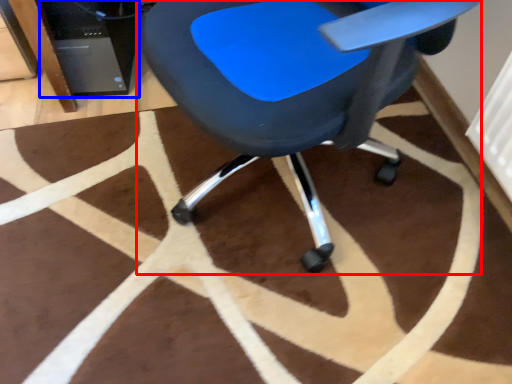
Question: Which object appears farthest to the camera in this image, chair (highlighted by a red box) or computer tower (highlighted by a blue box)?

Choices:
 (A) chair
 (B) computer tower

Answer: (B)